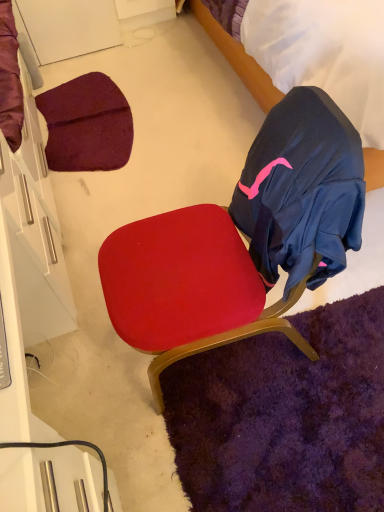
I want to click on velvet blue bed at upper right, so 238,59.

Image resolution: width=384 pixels, height=512 pixels. Describe the element at coordinates (238, 59) in the screenshot. I see `velvet blue bed at upper right` at that location.

You are a GUI agent. You are given a task and a screenshot of the screen. Output one action in this format:
    pyautogui.click(x=<x>, y=<y>)
    Task: Click on the velvet red chair at center
    The image size is (384, 512).
    Given the screenshot: What is the action you would take?
    pyautogui.click(x=241, y=241)

This screenshot has height=512, width=384. Describe the element at coordinates (241, 241) in the screenshot. I see `velvet red chair at center` at that location.

Where is `velvet blue bed at upper right`? The image size is (384, 512). velvet blue bed at upper right is located at coordinates (238, 59).

Between velvet red chair at center and velvet blue bed at upper right, which one appears on the left side from the viewer's perspective?

velvet red chair at center is more to the left.

Is velvet red chair at center in front of or behind velvet blue bed at upper right in the image?

Clearly, velvet red chair at center is in front of velvet blue bed at upper right.

Which point is more distant from viewer, (181, 222) or (193, 12)?

Point (193, 12)

From the image's perspective, which is above, velvet red chair at center or velvet blue bed at upper right?

velvet blue bed at upper right appears higher in the image.

From a real-world perspective, is velvet red chair at center under velvet blue bed at upper right?

Yes, from a real-world perspective, velvet red chair at center is below velvet blue bed at upper right.

Which object is thinner, velvet red chair at center or velvet blue bed at upper right?

Thinner between the two is velvet red chair at center.

Considering the sizes of velvet red chair at center and velvet blue bed at upper right in the image, is velvet red chair at center taller or shorter than velvet blue bed at upper right?

Clearly, velvet red chair at center is shorter compared to velvet blue bed at upper right.

From the picture: Which of these two, velvet red chair at center or velvet blue bed at upper right, is smaller?

Smaller between the two is velvet red chair at center.

Is velvet red chair at center situated inside velvet blue bed at upper right or outside?

velvet red chair at center is not inside velvet blue bed at upper right, it's outside.

Are velvet red chair at center and velvet blue bed at upper right making contact?

velvet red chair at center is not next to velvet blue bed at upper right, and they're not touching.

Is velvet red chair at center looking in the opposite direction of velvet blue bed at upper right?

No.

How different are the orientations of velvet red chair at center and velvet blue bed at upper right in degrees?

88.3 degrees separate the facing orientations of velvet red chair at center and velvet blue bed at upper right.

Where is `chair lying on the left of velvet blue bed at upper right`? chair lying on the left of velvet blue bed at upper right is located at coordinates 241,241.

Looking at this image, can you confirm if velvet blue bed at upper right is positioned to the right of velvet red chair at center?

Correct, you'll find velvet blue bed at upper right to the right of velvet red chair at center.

Does velvet blue bed at upper right lie behind velvet red chair at center?

Yes, the depth of velvet blue bed at upper right is greater than that of velvet red chair at center.

Does point (251, 89) lie behind point (311, 221)?

Yes, it is.

In the scene shown: From the image's perspective, would you say velvet blue bed at upper right is shown under velvet red chair at center?

Incorrect, from the image's perspective, velvet blue bed at upper right is higher than velvet red chair at center.

From a real-world perspective, is velvet blue bed at upper right under velvet red chair at center?

No, from a real-world perspective, velvet blue bed at upper right is not beneath velvet red chair at center.

Looking at their sizes, would you say velvet blue bed at upper right is wider or thinner than velvet red chair at center?

In the image, velvet blue bed at upper right appears to be wider than velvet red chair at center.

Who is shorter, velvet blue bed at upper right or velvet red chair at center?

Standing shorter between the two is velvet red chair at center.

Looking at this image, between velvet blue bed at upper right and velvet red chair at center, which one has smaller size?

With smaller size is velvet red chair at center.

Which is correct: velvet blue bed at upper right is inside velvet red chair at center, or outside of it?

velvet blue bed at upper right lies outside velvet red chair at center.

Based on the photo, would you say velvet blue bed at upper right is a long distance from velvet red chair at center?

Indeed, velvet blue bed at upper right is not near velvet red chair at center.

Is velvet blue bed at upper right oriented towards velvet red chair at center?

No, velvet blue bed at upper right is not aimed at velvet red chair at center.

Image resolution: width=384 pixels, height=512 pixels. What are the coordinates of `chair to the left of velvet blue bed at upper right` in the screenshot? It's located at (241, 241).

Locate an element on the screen. chair located on the left of velvet blue bed at upper right is located at coordinates (241, 241).

Where is `bed above the velvet red chair at center (from the image's perspective)`? This screenshot has height=512, width=384. bed above the velvet red chair at center (from the image's perspective) is located at coordinates click(x=238, y=59).